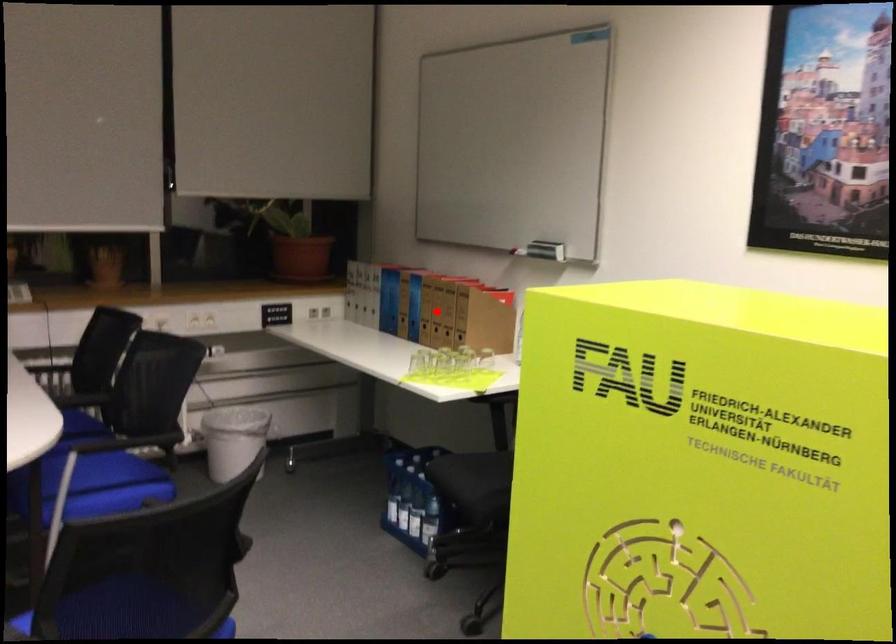
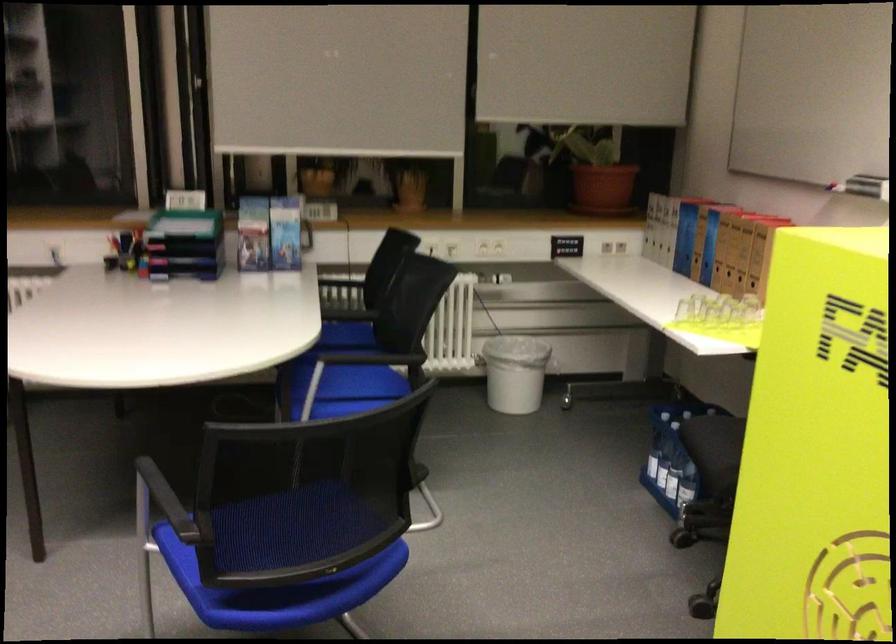
Question: I am providing you with two images of the same scene from different viewpoints. A red point is marked on the first image. At the location where the point appears in image 1, is it still visible in image 2?

Choices:
 (A) Yes
 (B) No

Answer: (A)